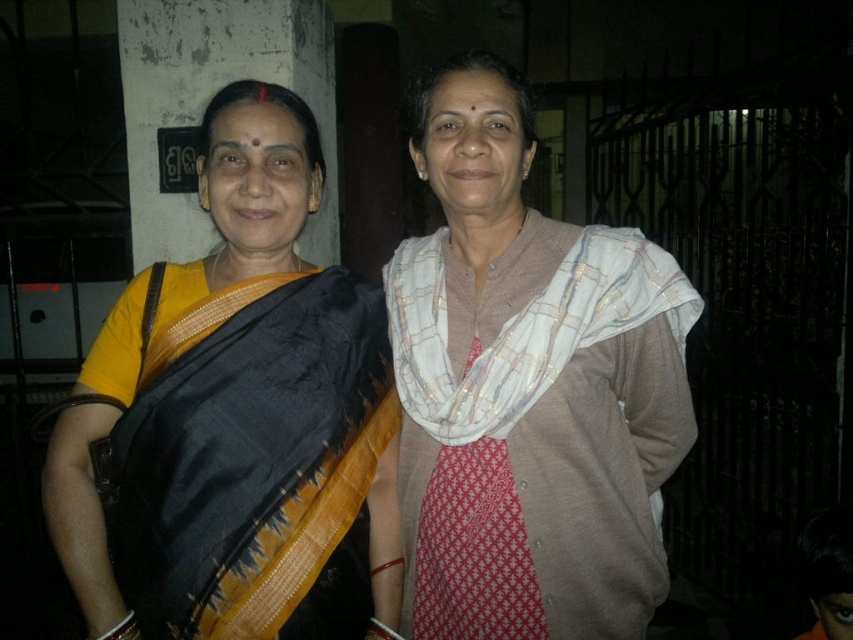
Question: Does matte brown scarf at center have a lesser width compared to white textured scarf at center?

Choices:
 (A) no
 (B) yes

Answer: (A)

Question: Which of the following is the farthest from the observer?

Choices:
 (A) silk saree at left
 (B) matte brown scarf at center

Answer: (B)

Question: Can you confirm if matte brown scarf at center is bigger than white textured scarf at center?

Choices:
 (A) yes
 (B) no

Answer: (A)

Question: Considering the relative positions of matte brown scarf at center and white textured scarf at center in the image provided, where is matte brown scarf at center located with respect to white textured scarf at center?

Choices:
 (A) right
 (B) left

Answer: (A)

Question: Which of these objects is positioned farthest from the silk saree at left?

Choices:
 (A) white textured scarf at center
 (B) matte brown scarf at center

Answer: (A)

Question: Which is farther from the silk saree at left?

Choices:
 (A) matte brown scarf at center
 (B) white textured scarf at center

Answer: (B)